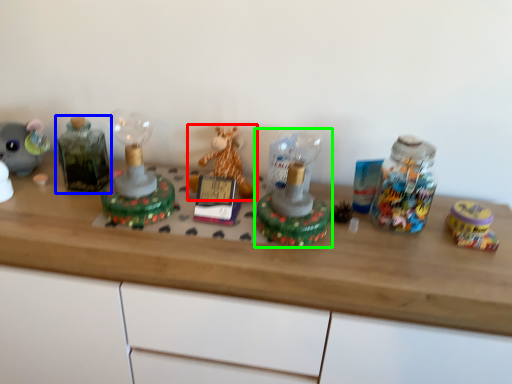
Question: Which object is the farthest from toy (highlighted by a red box)? Choose among these: bottle (highlighted by a blue box) or toy (highlighted by a green box).

Choices:
 (A) bottle
 (B) toy

Answer: (A)